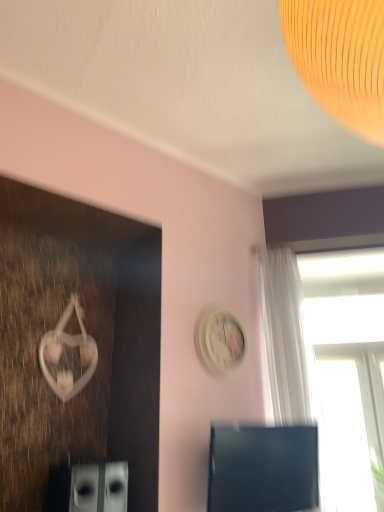
Question: Considering the relative positions of transparent glass window at upper right and black glossy computer monitor at lower right in the image provided, is transparent glass window at upper right to the left or to the right of black glossy computer monitor at lower right?

Choices:
 (A) left
 (B) right

Answer: (B)

Question: Is transparent glass window at upper right in front of or behind black glossy computer monitor at lower right in the image?

Choices:
 (A) front
 (B) behind

Answer: (B)

Question: Considering the real-world distances, which object is farthest from the transparent glass window at upper right?

Choices:
 (A) black glossy computer monitor at lower right
 (B) white glossy clock at upper center

Answer: (B)

Question: Estimate the real-world distances between objects in this image. Which object is closer to the white glossy clock at upper center?

Choices:
 (A) transparent glass window at upper right
 (B) black glossy computer monitor at lower right

Answer: (B)